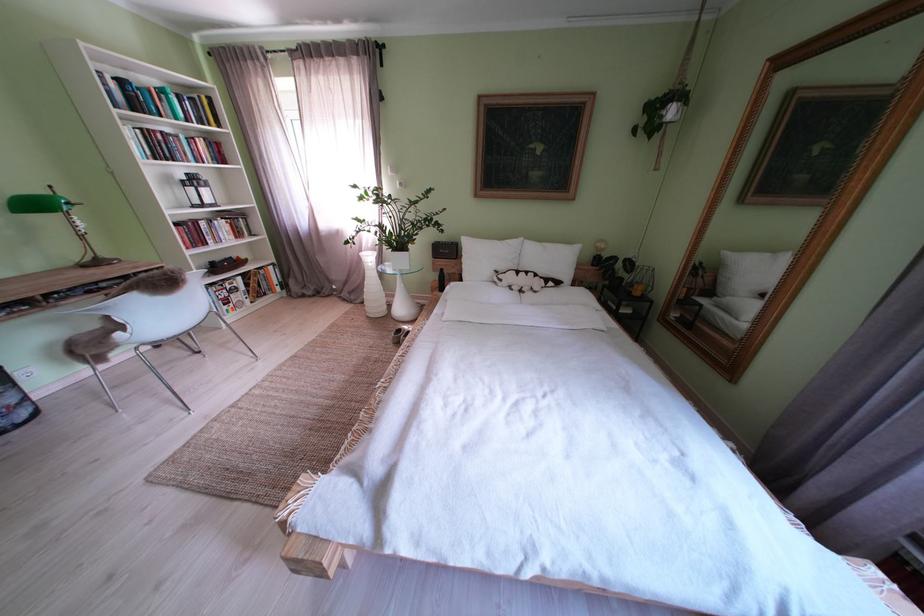
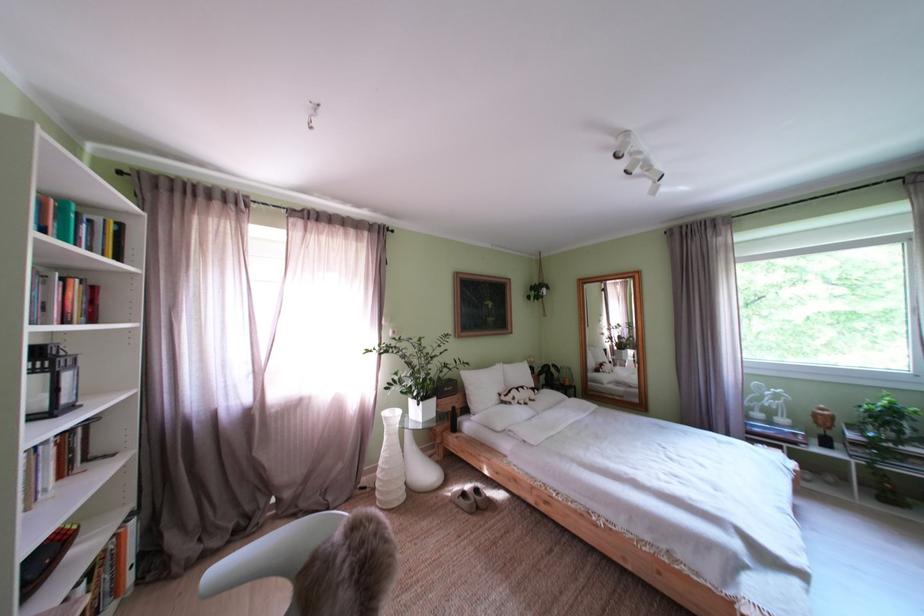
Question: I am providing you with two images of the same scene from different viewpoints. Please identify which objects are invisible in image2.

Choices:
 (A) black lantern
 (B) large white vase
 (C) small white vase
 (D) none of these

Answer: (D)